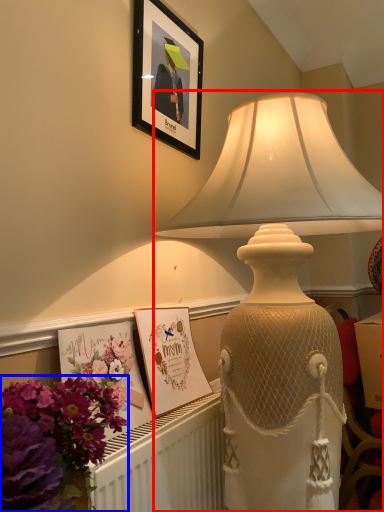
Question: Which object appears farthest to the camera in this image, lamp (highlighted by a red box) or flower (highlighted by a blue box)?

Choices:
 (A) lamp
 (B) flower

Answer: (A)